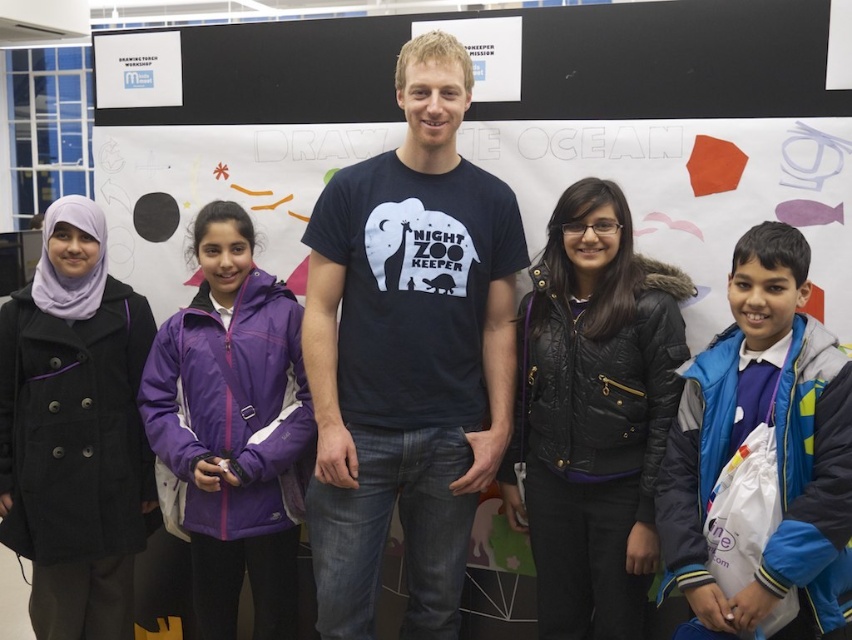
Is dark blue t-shirt at center taller than black quilted jacket at center?

Correct, dark blue t-shirt at center is much taller as black quilted jacket at center.

Is point (372, 336) less distant than point (527, 321)?

Yes, it is.

Find the location of a particular element. The image size is (852, 640). dark blue t-shirt at center is located at coordinates (407, 353).

Consider the image. Which of these two, black quilted jacket at center or purple fleece jacket at center, stands taller?

purple fleece jacket at center is taller.

Is point (653, 556) in front of point (193, 529)?

Yes, it is in front of point (193, 529).

At what (x,y) coordinates should I click in order to perform the action: click on black quilted jacket at center. Please return your answer as a coordinate pair (x, y). The height and width of the screenshot is (640, 852). Looking at the image, I should click on (593, 413).

Which of these two, black wool coat at left or purple fleece jacket at center, stands taller?

Standing taller between the two is black wool coat at left.

Which is more to the left, black wool coat at left or purple fleece jacket at center?

black wool coat at left is more to the left.

Who is more distant from viewer, (84, 529) or (269, 481)?

The point (84, 529) is more distant.

You are a GUI agent. You are given a task and a screenshot of the screen. Output one action in this format:
    pyautogui.click(x=<x>, y=<y>)
    Task: Click on the black wool coat at left
    
    Given the screenshot: What is the action you would take?
    pyautogui.click(x=73, y=429)